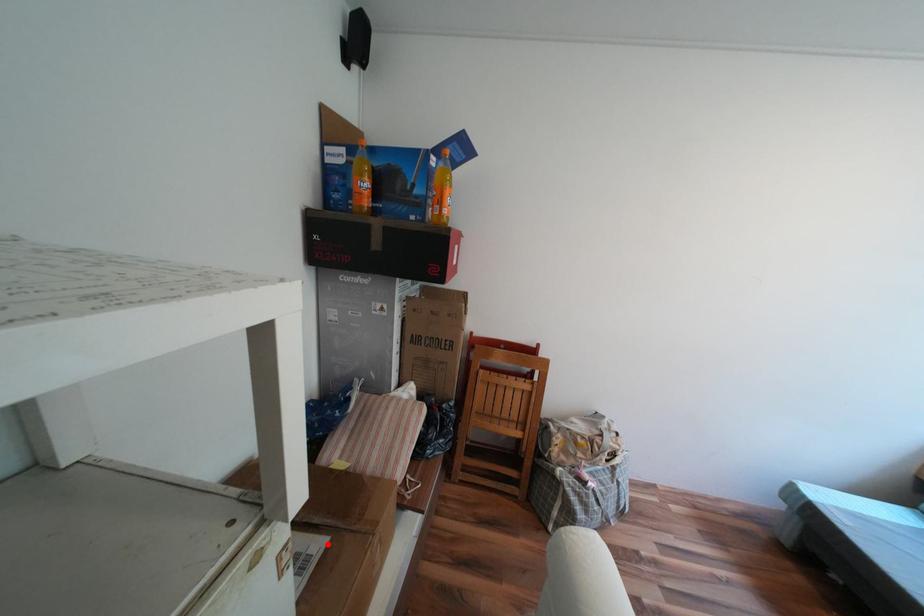
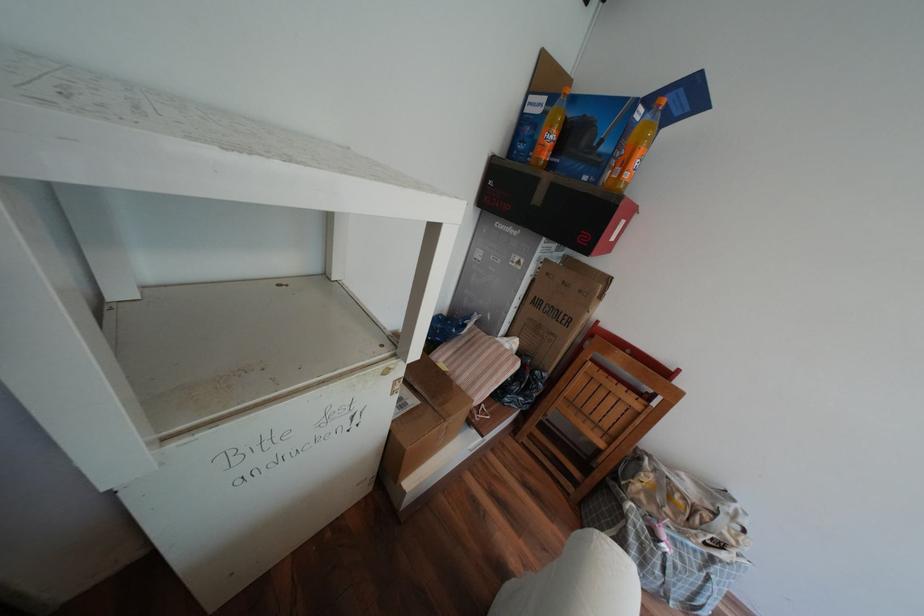
Locate, in the second image, the point that corresponds to the highlighted location in the first image.

(422, 400)